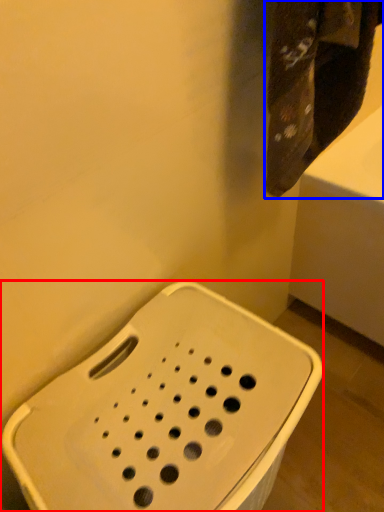
Question: Which object appears closest to the camera in this image, porcelain (highlighted by a red box) or towel (highlighted by a blue box)?

Choices:
 (A) porcelain
 (B) towel

Answer: (A)